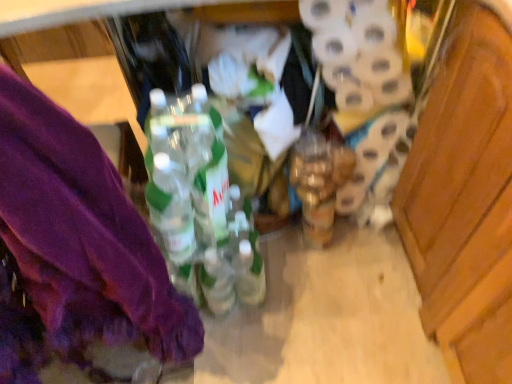
The image size is (512, 384). Describe the element at coordinates (74, 247) in the screenshot. I see `purple fabric at left` at that location.

This screenshot has height=384, width=512. Identify the location of translucent plastic bottles at center. (202, 201).

Where is `purple fabric at left`? The width and height of the screenshot is (512, 384). purple fabric at left is located at coordinates (74, 247).

Which of these two, translucent plastic bottles at center or white matte toilet paper at center right, stands shorter?

With less height is white matte toilet paper at center right.

Identify the location of toilet paper lying behind the translucent plastic bottles at center. (364, 89).

From the image's perspective, is translucent plastic bottles at center located above or below white matte toilet paper at center right?

translucent plastic bottles at center is below white matte toilet paper at center right.

Considering the relative positions of translucent plastic bottles at center and white matte toilet paper at center right in the image provided, is translucent plastic bottles at center behind white matte toilet paper at center right?

No, translucent plastic bottles at center is closer to the viewer.

Looking at this image, which object is closer to the camera taking this photo, translucent plastic bottles at center or purple fabric at left?

purple fabric at left.

Does translucent plastic bottles at center have a larger size compared to purple fabric at left?

Incorrect, translucent plastic bottles at center is not larger than purple fabric at left.

Is there a large distance between translucent plastic bottles at center and purple fabric at left?

Actually, translucent plastic bottles at center and purple fabric at left are a little close together.

From the image's perspective, is translucent plastic bottles at center on top of purple fabric at left?

No.

Is purple fabric at left not inside white matte toilet paper at center right?

Yes, purple fabric at left is not within white matte toilet paper at center right.

Is purple fabric at left wider than white matte toilet paper at center right?

Yes.

From the image's perspective, which one is positioned higher, purple fabric at left or white matte toilet paper at center right?

white matte toilet paper at center right.

From the image's perspective, is white matte toilet paper at center right below translucent plastic bottles at center?

No, from the image's perspective, white matte toilet paper at center right is not beneath translucent plastic bottles at center.

Is point (356, 140) closer to viewer compared to point (168, 221)?

No, it is behind (168, 221).

Who is smaller, white matte toilet paper at center right or translucent plastic bottles at center?

white matte toilet paper at center right.

Which is closer to the camera, (19, 319) or (200, 85)?

Point (19, 319) appears to be closer to the viewer than point (200, 85).

Is translucent plastic bottles at center inside purple fabric at left?

No, translucent plastic bottles at center is not a part of purple fabric at left.

Is purple fabric at left oriented towards translucent plastic bottles at center?

No.

Can you confirm if purple fabric at left is taller than translucent plastic bottles at center?

Yes.

Considering the sizes of objects white matte toilet paper at center right and purple fabric at left in the image provided, who is bigger, white matte toilet paper at center right or purple fabric at left?

purple fabric at left.

Consider the image. Is purple fabric at left completely or partially inside white matte toilet paper at center right?

No, purple fabric at left is not a part of white matte toilet paper at center right.

From a real-world perspective, which object rests below the other?

white matte toilet paper at center right is physically lower.

Can you confirm if white matte toilet paper at center right is positioned to the right of purple fabric at left?

Yes.

This screenshot has height=384, width=512. I want to click on bottle to the left of white matte toilet paper at center right, so click(202, 201).

At what (x,y) coordinates should I click in order to perform the action: click on underclothes above the translucent plastic bottles at center (from the image's perspective). Please return your answer as a coordinate pair (x, y). Looking at the image, I should click on (74, 247).

Looking at the image, which one is located closer to translucent plastic bottles at center, purple fabric at left or white matte toilet paper at center right?

The object closer to translucent plastic bottles at center is purple fabric at left.

When comparing their distances from purple fabric at left, does white matte toilet paper at center right or translucent plastic bottles at center seem further?

Among the two, white matte toilet paper at center right is located further to purple fabric at left.

Considering their positions, is purple fabric at left positioned closer to white matte toilet paper at center right than translucent plastic bottles at center?

The object closer to white matte toilet paper at center right is translucent plastic bottles at center.

When comparing their distances from translucent plastic bottles at center, does white matte toilet paper at center right or purple fabric at left seem further?

white matte toilet paper at center right is positioned further to the anchor translucent plastic bottles at center.

Estimate the real-world distances between objects in this image. Which object is further from purple fabric at left, translucent plastic bottles at center or white matte toilet paper at center right?

white matte toilet paper at center right is further to purple fabric at left.

Considering their positions, is translucent plastic bottles at center positioned closer to white matte toilet paper at center right than purple fabric at left?

translucent plastic bottles at center is positioned closer to the anchor white matte toilet paper at center right.

Identify the location of bottle between purple fabric at left and white matte toilet paper at center right from front to back. (202, 201).